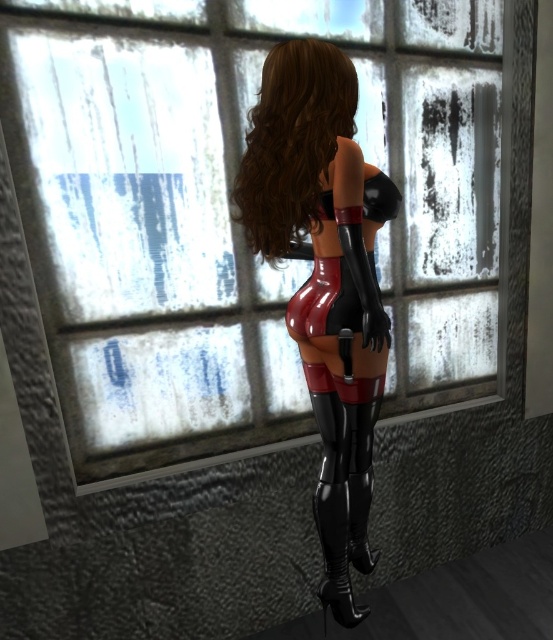
You are a photographer adjusting your camera settings to capture the character in the scene. You want to ensure both the glossy latex outfit at center and the shiny brown hair at center are in focus. Given that your camera has a depth of field that can cover 5 inches, will both objects be in focus?

The glossy latex outfit at center and the shiny brown hair at center are 4.79 inches apart. Since the depth of field can cover 5 inches, both objects will be in focus.

You are a photographer setting up a shoot in this room. You want to ensure that the glossy latex outfit at center and the shiny brown hair at center are both visible in the reflection of a nearby mirror. Given their sizes, which object will appear taller in the mirror?

The glossy latex outfit at center will appear taller in the mirror because it has a greater height compared to the shiny brown hair at center.